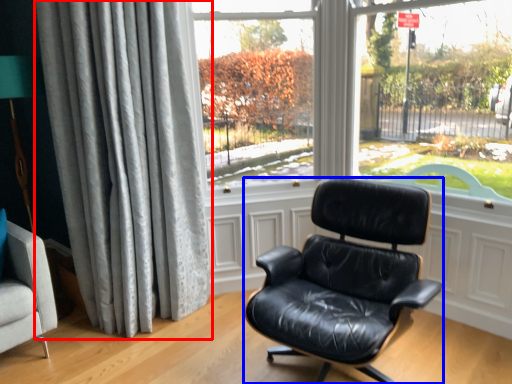
Question: Which of the following is the closest to the observer, curtain (highlighted by a red box) or chair (highlighted by a blue box)?

Choices:
 (A) curtain
 (B) chair

Answer: (B)